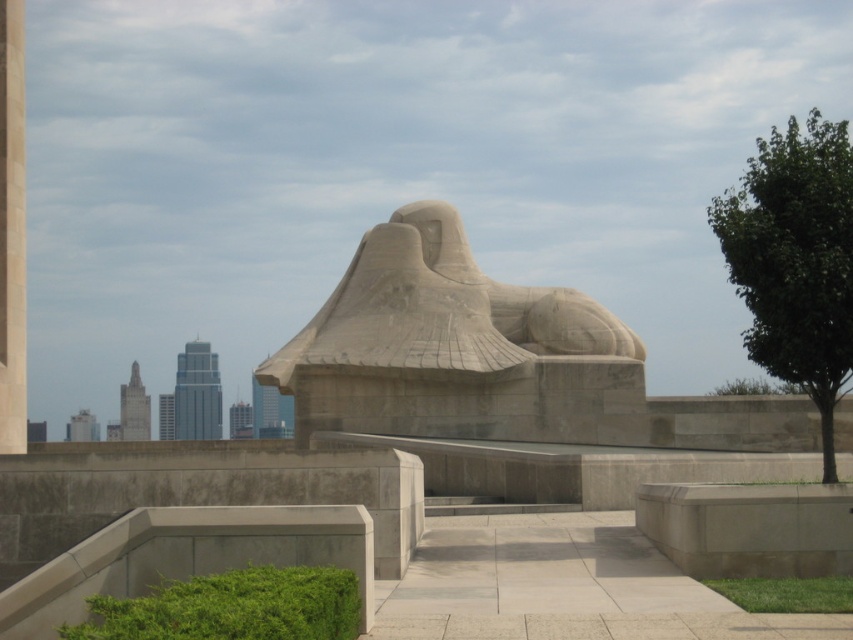
You are a city planner evaluating the space around the sculpture. You need to determine if the green leafy tree at right and the smooth concrete pillar at left can be moved closer together without removing either. Based on their sizes, is this feasible?

The green leafy tree at right is larger in size than the smooth concrete pillar at left. Since the tree is bigger, there might be limited space to move them closer without compromising their placement. It may not be feasible unless there is sufficient space to accommodate the tree.